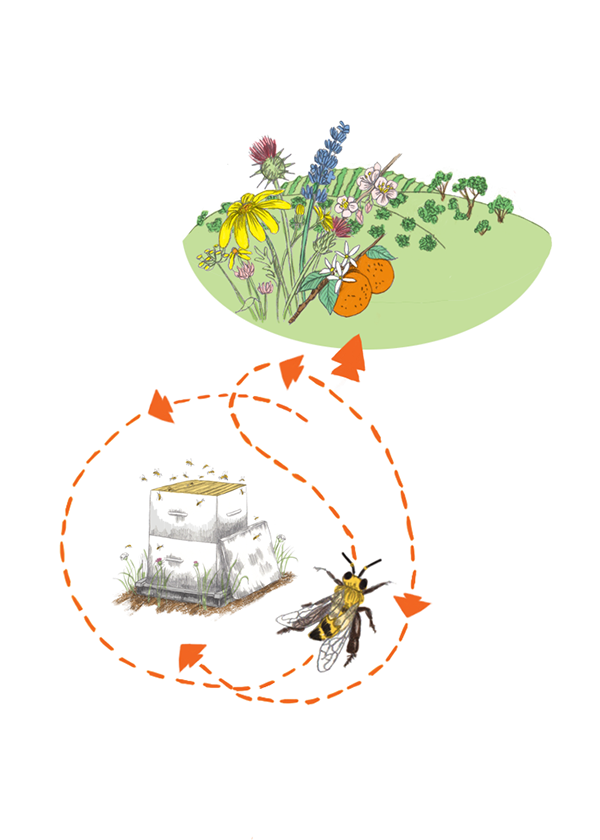
What are the coordinates of `green plants` in the screenshot? It's located at (475, 190), (505, 210).